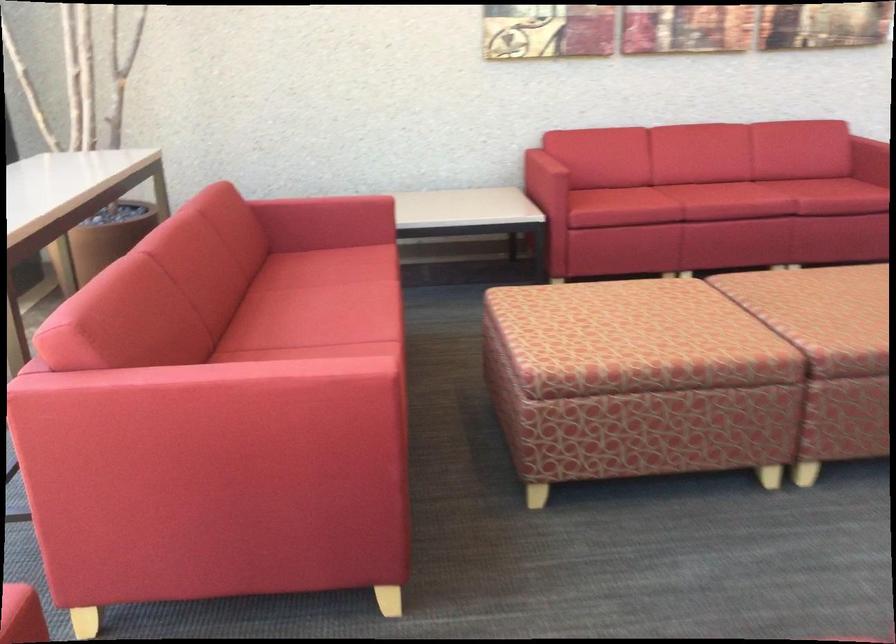
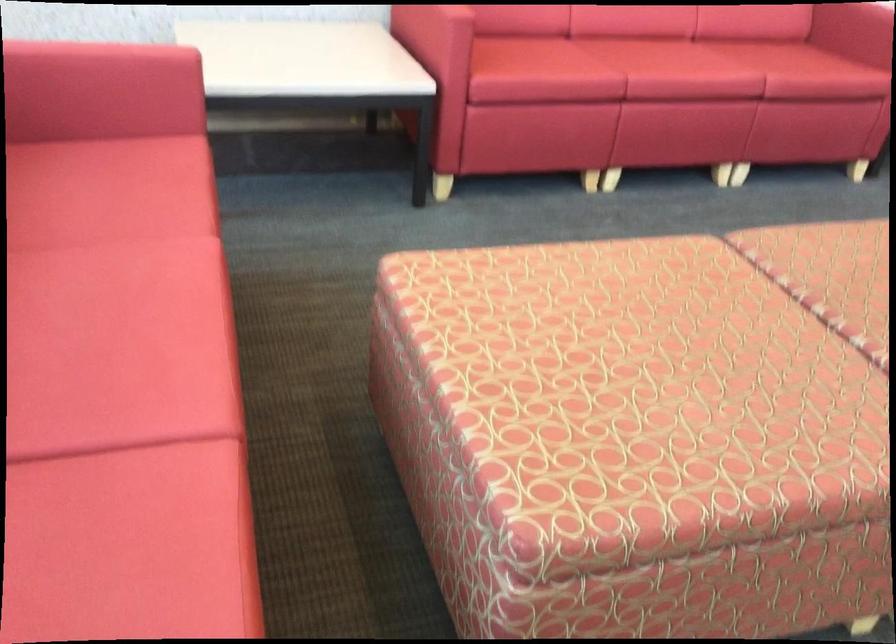
The point at (721, 187) is marked in the first image. Where is the corresponding point in the second image?

(677, 62)